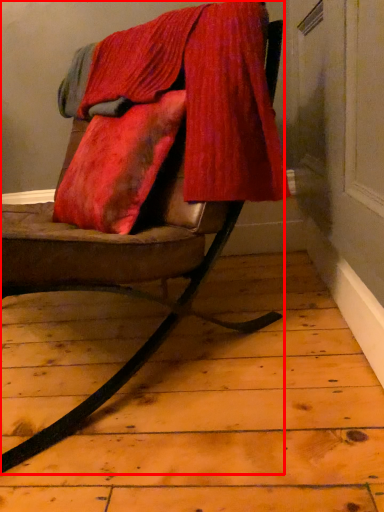
Question: Considering the relative positions of chair (annotated by the red box) and velvet in the image provided, where is chair (annotated by the red box) located with respect to the staircase?

Choices:
 (A) right
 (B) left

Answer: (B)